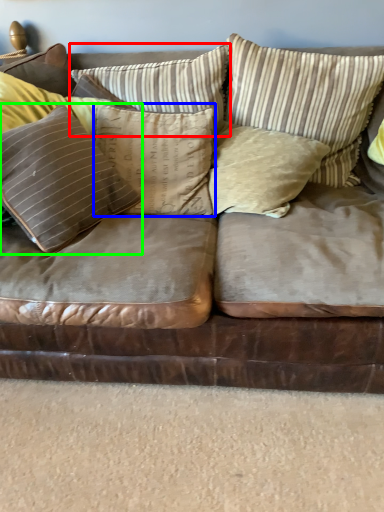
Question: Based on their relative distances, which object is farther from pillow (highlighted by a red box)? Choose from pillow (highlighted by a blue box) and pillow (highlighted by a green box).

Choices:
 (A) pillow
 (B) pillow

Answer: (B)